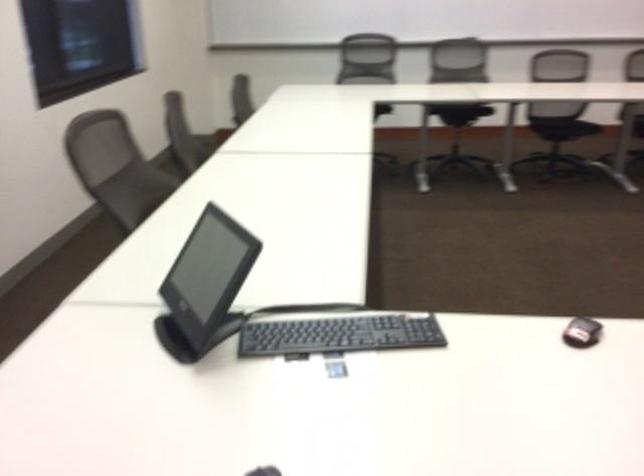
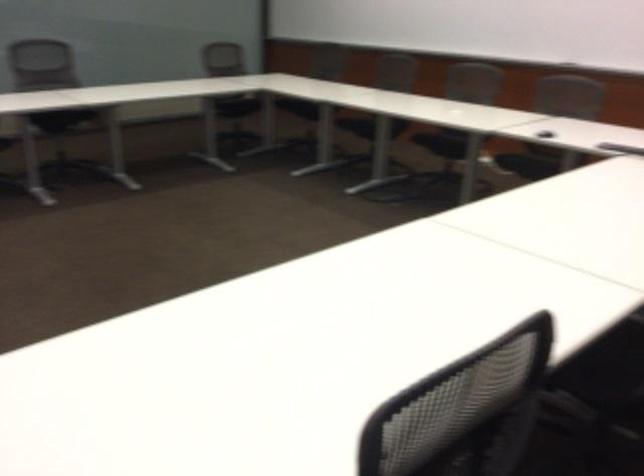
Consider the image. The first image is from the beginning of the video and the second image is from the end. How did the camera likely rotate when shooting the video?

The rotation direction of the camera is right-down.